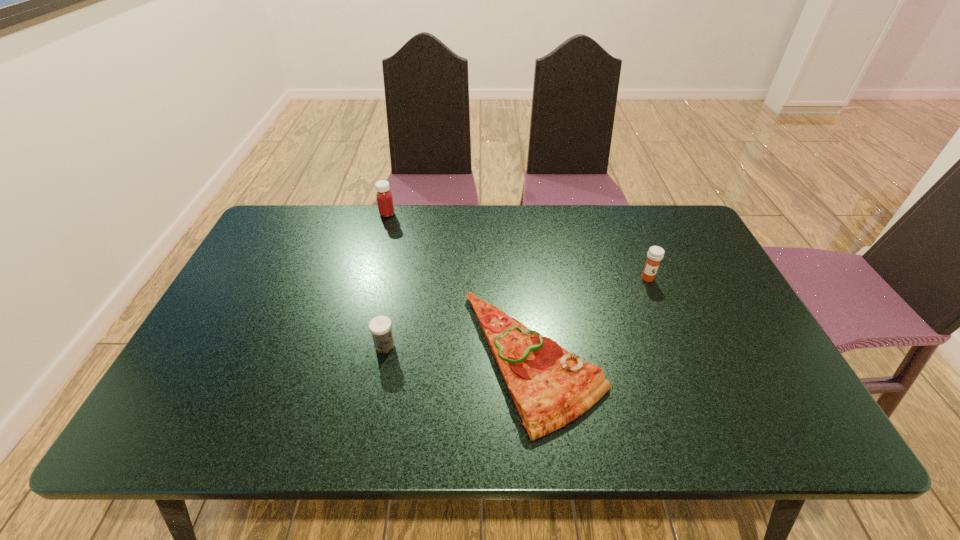
Locate an element on the screen. The width and height of the screenshot is (960, 540). free space between the pizza and the nearest medicine is located at coordinates (459, 353).

Image resolution: width=960 pixels, height=540 pixels. Find the location of `empty location between the shortest object and the second medicine from left to right`. empty location between the shortest object and the second medicine from left to right is located at coordinates (459, 353).

Where is `vacant area that lies between the shortest object and the leftmost object`? This screenshot has height=540, width=960. vacant area that lies between the shortest object and the leftmost object is located at coordinates (461, 287).

Where is `free space between the farthest medicine and the second shortest object`? free space between the farthest medicine and the second shortest object is located at coordinates (386, 280).

Where is `free space between the rightmost medicine and the leftmost medicine`? free space between the rightmost medicine and the leftmost medicine is located at coordinates (517, 246).

Find the location of a particular element. Image resolution: width=960 pixels, height=540 pixels. free space between the pizza and the second nearest medicine is located at coordinates (590, 319).

You are a GUI agent. You are given a task and a screenshot of the screen. Output one action in this format:
    pyautogui.click(x=<x>, y=<y>)
    Task: Click on the unoccupied position between the pizza and the nearest medicine
    Image resolution: width=960 pixels, height=540 pixels.
    Given the screenshot: What is the action you would take?
    pyautogui.click(x=459, y=353)

Identify the location of free space between the second object from right to left and the second medicine from right to left. Image resolution: width=960 pixels, height=540 pixels. (459, 353).

The width and height of the screenshot is (960, 540). What are the coordinates of `free spot between the rightmost medicine and the pizza` in the screenshot? It's located at (590, 319).

You are a GUI agent. You are given a task and a screenshot of the screen. Output one action in this format:
    pyautogui.click(x=<x>, y=<y>)
    Task: Click on the vacant area that lies between the second farthest medicine and the third tallest object
    This screenshot has height=540, width=960.
    Given the screenshot: What is the action you would take?
    pyautogui.click(x=516, y=312)